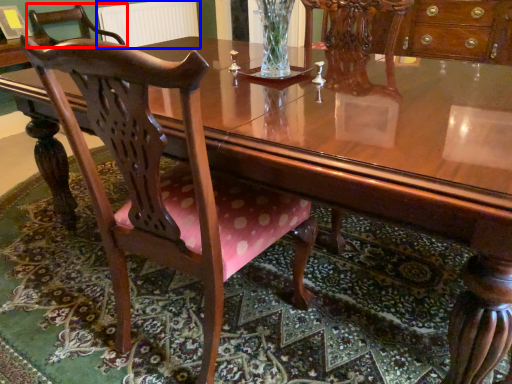
Question: Which point is further to the camera, chair (highlighted by a red box) or radiator (highlighted by a blue box)?

Choices:
 (A) chair
 (B) radiator

Answer: (B)